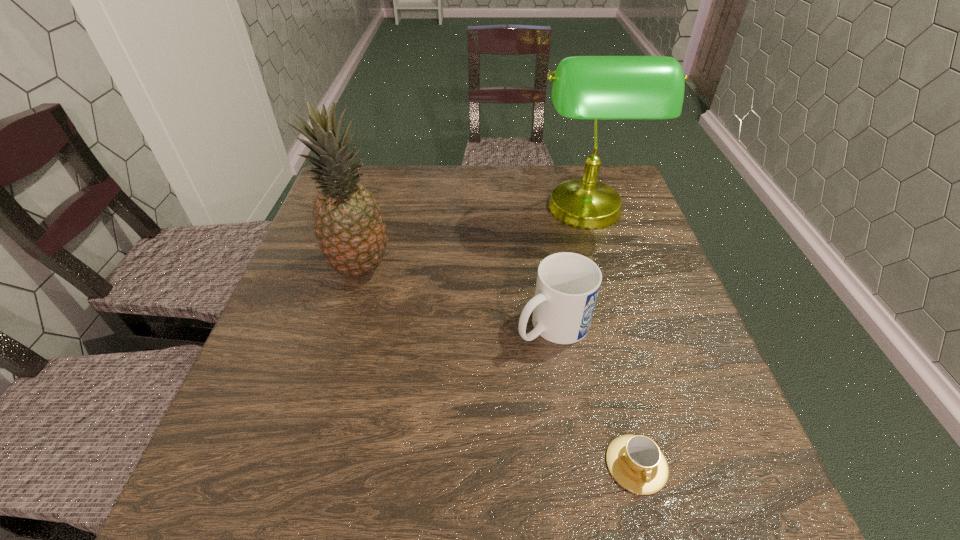
You are a GUI agent. You are given a task and a screenshot of the screen. Output one action in this format:
    pyautogui.click(x=<x>, y=<y>)
    Task: Click on the blank space located 0.050m on the left of the leftmost object
    This screenshot has height=540, width=960.
    Given the screenshot: What is the action you would take?
    pyautogui.click(x=307, y=268)

This screenshot has height=540, width=960. What are the coordinates of `free region located on the front of the second nearest object` in the screenshot? It's located at (564, 402).

Image resolution: width=960 pixels, height=540 pixels. Identify the location of object that is at the far edge. pyautogui.click(x=584, y=87).

Locate an element on the screen. object positioned at the near edge is located at coordinates (635, 461).

You are a GUI agent. You are given a task and a screenshot of the screen. Output one action in this format:
    pyautogui.click(x=<x>, y=<y>)
    Task: Click on the object at the left edge
    This screenshot has height=540, width=960.
    Given the screenshot: What is the action you would take?
    pyautogui.click(x=349, y=228)

Locate an element on the screen. lamp that is positioned at the right edge is located at coordinates (584, 87).

At what (x,y) coordinates should I click in order to perform the action: click on cup at the right edge. Please return your answer as a coordinate pair (x, y). The width and height of the screenshot is (960, 540). Looking at the image, I should click on (635, 461).

I want to click on object that is at the far right corner, so click(x=584, y=87).

Find the location of a particular element. The height and width of the screenshot is (540, 960). object that is at the near right corner is located at coordinates (635, 461).

The width and height of the screenshot is (960, 540). I want to click on vacant space at the far edge of the desktop, so 504,204.